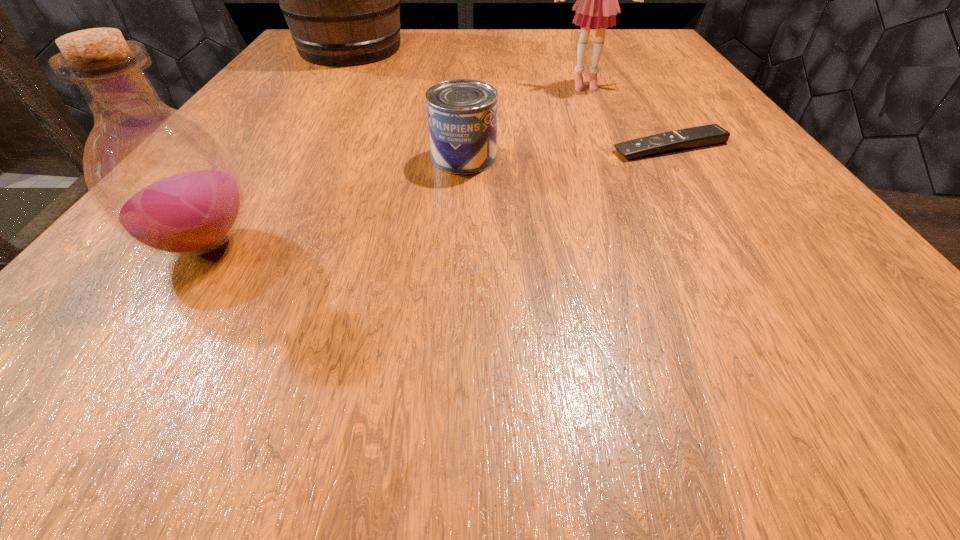
The width and height of the screenshot is (960, 540). I want to click on vacant region located 0.100m on the front-facing side of the second farthest object, so click(598, 117).

The width and height of the screenshot is (960, 540). In order to click on blank space located on the back of the bottle in this screenshot , I will do `click(258, 166)`.

Find the location of a particular element. This screenshot has width=960, height=540. vacant space located on the front label of the can is located at coordinates (604, 157).

Locate an element on the screen. vacant space located on the back of the remote control is located at coordinates (652, 117).

I want to click on object that is positioned at the far edge, so click(341, 0).

Where is `wine bucket present at the left edge`? This screenshot has width=960, height=540. wine bucket present at the left edge is located at coordinates (341, 0).

I want to click on bottle situated at the left edge, so click(x=162, y=179).

Locate an element on the screen. doll located in the right edge section of the desktop is located at coordinates (597, 5).

You are a GUI agent. You are given a task and a screenshot of the screen. Output one action in this format:
    pyautogui.click(x=<x>, y=<y>)
    Task: Click on the remote control situated at the right edge
    
    Given the screenshot: What is the action you would take?
    pyautogui.click(x=712, y=134)

You are a GUI agent. You are given a task and a screenshot of the screen. Output one action in this format:
    pyautogui.click(x=<x>, y=<y>)
    Task: Click on the object that is positioned at the far left corner
    The width and height of the screenshot is (960, 540).
    Given the screenshot: What is the action you would take?
    pyautogui.click(x=341, y=0)